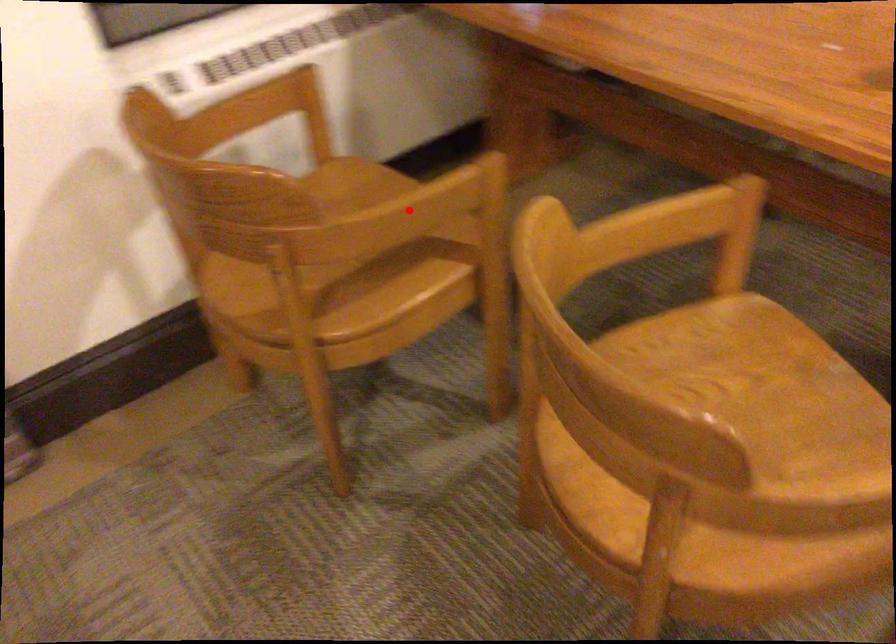
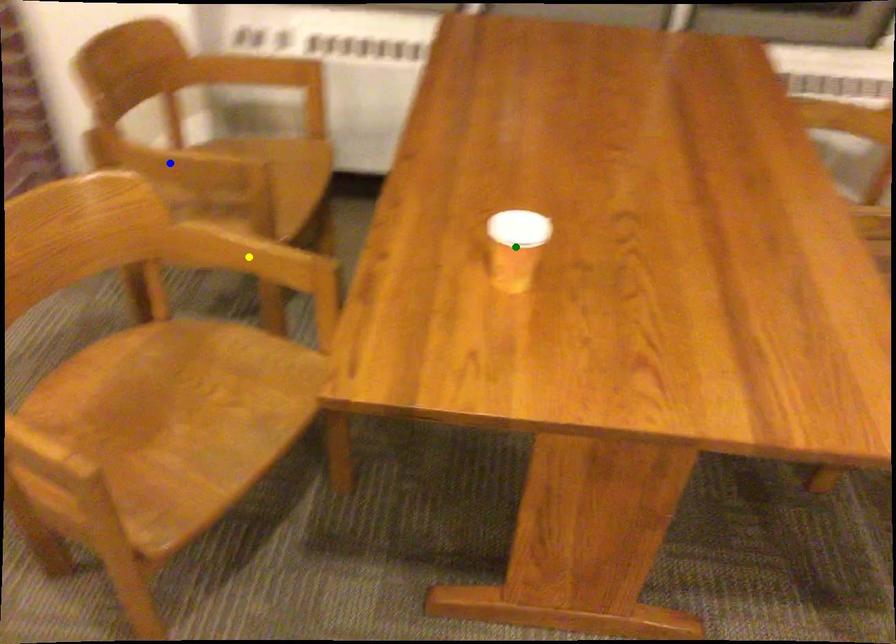
Question: I am providing you with two images of the same scene from different viewpoints. A red point is marked on the first image. You are given multiple points on the second image. Which spot in image 2 lines up with the point in image 1?

Choices:
 (A) green point
 (B) yellow point
 (C) blue point

Answer: (C)